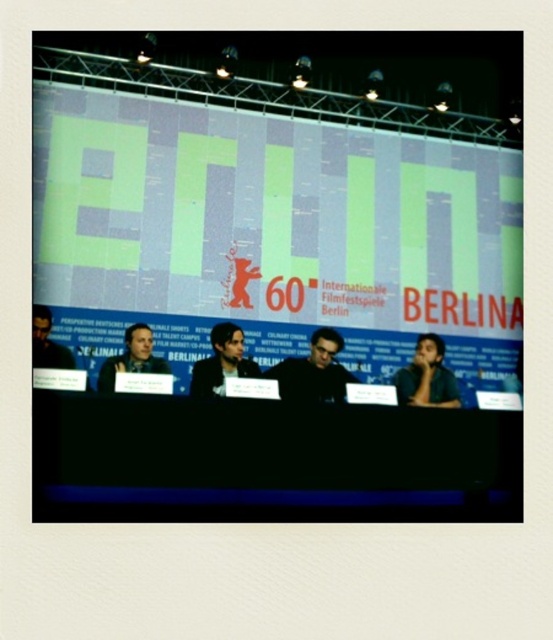
You are a photographer at the event and need to ensure that both the dark gray sweater at center and the dark hair person at left are clearly visible in your photo. Given their height difference, which object should you adjust your camera angle to focus on to capture both effectively?

The dark gray sweater at center is much taller than the dark hair person at left, so you should lower your camera angle to ensure the taller sweater and the shorter dark hair person at left are both in clear view.